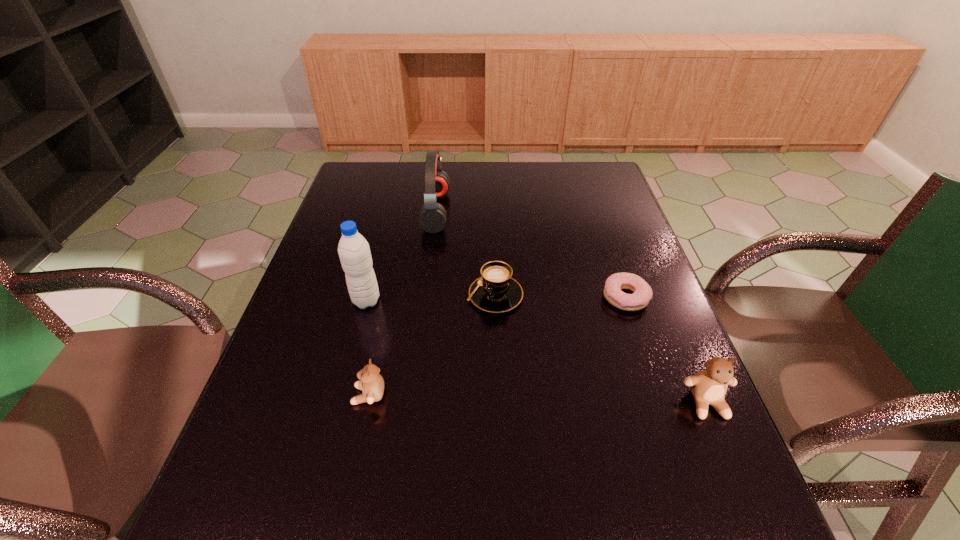
Locate an element on the screen. The width and height of the screenshot is (960, 540). vacant position in the image that satisfies the following two spatial constraints: 1. on the ear cups of the earphone; 2. on the front side of the water bottle is located at coordinates (424, 301).

Where is `vacant space that satisfies the following two spatial constraints: 1. on the ear cups of the fifth shortest object; 2. on the front side of the tallest object`? The image size is (960, 540). vacant space that satisfies the following two spatial constraints: 1. on the ear cups of the fifth shortest object; 2. on the front side of the tallest object is located at coordinates (424, 301).

Locate an element on the screen. This screenshot has height=540, width=960. free space that satisfies the following two spatial constraints: 1. on the ear cups of the doughnut; 2. on the right side of the farthest object is located at coordinates (425, 297).